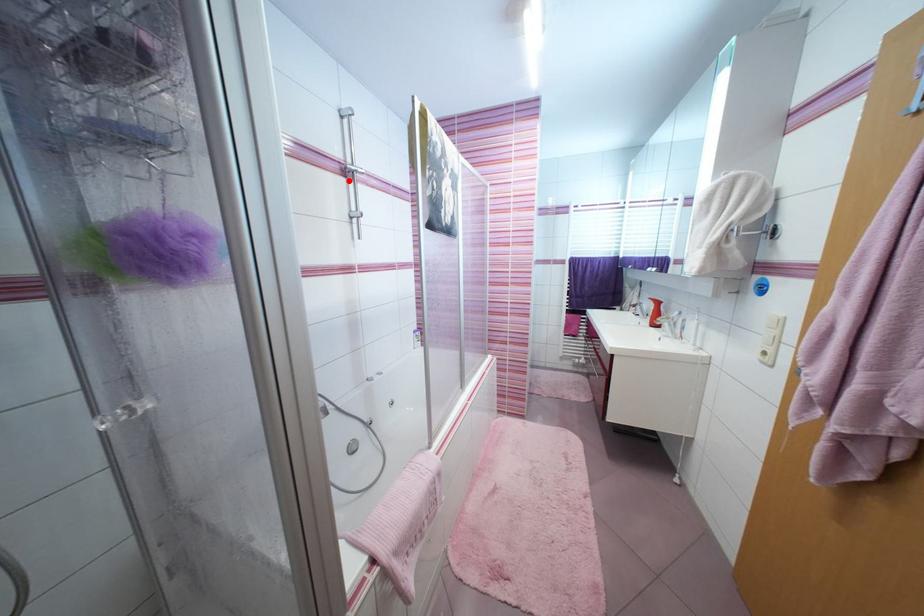
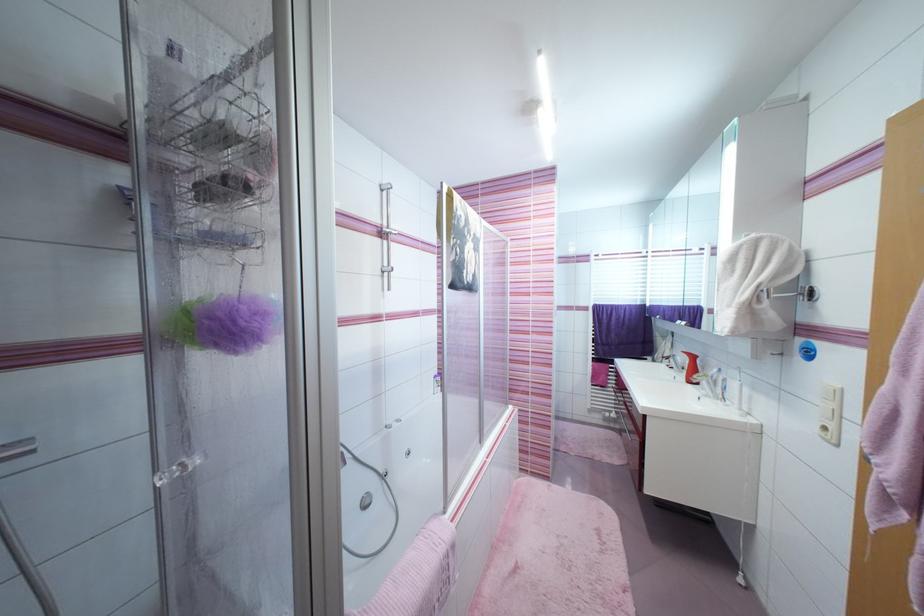
The point at the highlighted location is marked in the first image. Where is the corresponding point in the second image?

(383, 241)